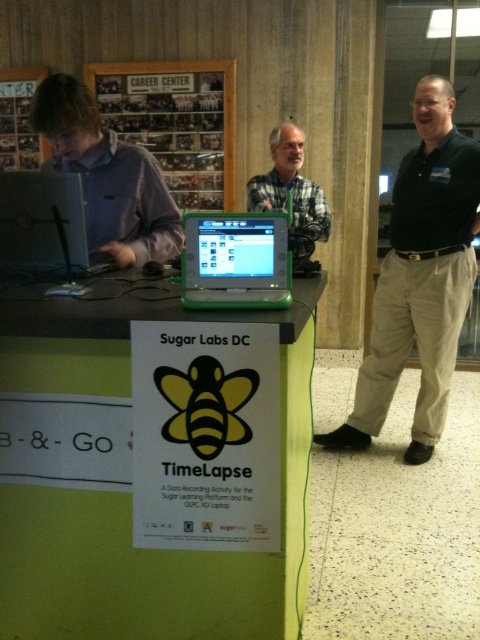
Question: Among these points, which one is farthest from the camera?

Choices:
 (A) (279, 154)
 (B) (117, 152)

Answer: (A)

Question: Does matte black laptop at left come behind gray flannel shirt at center?

Choices:
 (A) yes
 (B) no

Answer: (B)

Question: Which point is farther to the camera?

Choices:
 (A) (172, 125)
 (B) (94, 134)
 (C) (447, 104)
 (D) (48, 154)

Answer: (D)

Question: Which of the following is the closest to the observer?

Choices:
 (A) click(55, 461)
 (B) click(183, 260)

Answer: (B)

Question: Is green plastic laptop at center thinner than metallic silver bulletin board at upper left?

Choices:
 (A) yes
 (B) no

Answer: (A)

Question: Does green plastic table at center appear over metallic silver bulletin board at upper left?

Choices:
 (A) no
 (B) yes

Answer: (A)